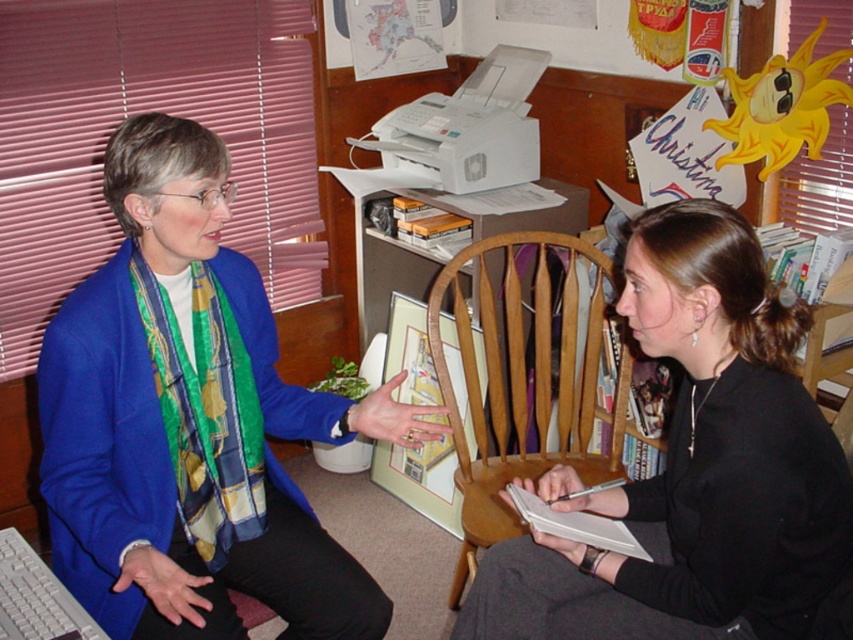
Can you confirm if wooden chair at center is positioned below white cardboard computer desk at center?

Yes, wooden chair at center is below white cardboard computer desk at center.

Which is above, wooden chair at center or white cardboard computer desk at center?

white cardboard computer desk at center

Is point (479, 289) farther from viewer compared to point (376, 324)?

That is False.

The image size is (853, 640). Find the location of `wooden chair at center`. wooden chair at center is located at coordinates (523, 378).

Does blue silk scarf at upper left have a greater height compared to black matte notebook at center?

Yes.

Between point (221, 172) and point (680, 468), which one is positioned behind?

Positioned behind is point (680, 468).

Is point (181, 273) positioned in front of point (785, 340)?

No, it is behind (785, 340).

The height and width of the screenshot is (640, 853). I want to click on blue silk scarf at upper left, so click(190, 420).

Measure the distance between point (694, 589) and camera.

Point (694, 589) and camera are 4.84 feet apart from each other.

In the scene shown: Which is more to the right, black matte notebook at center or white cardboard computer desk at center?

black matte notebook at center is more to the right.

The height and width of the screenshot is (640, 853). In order to click on black matte notebook at center in this screenshot , I will do `click(693, 467)`.